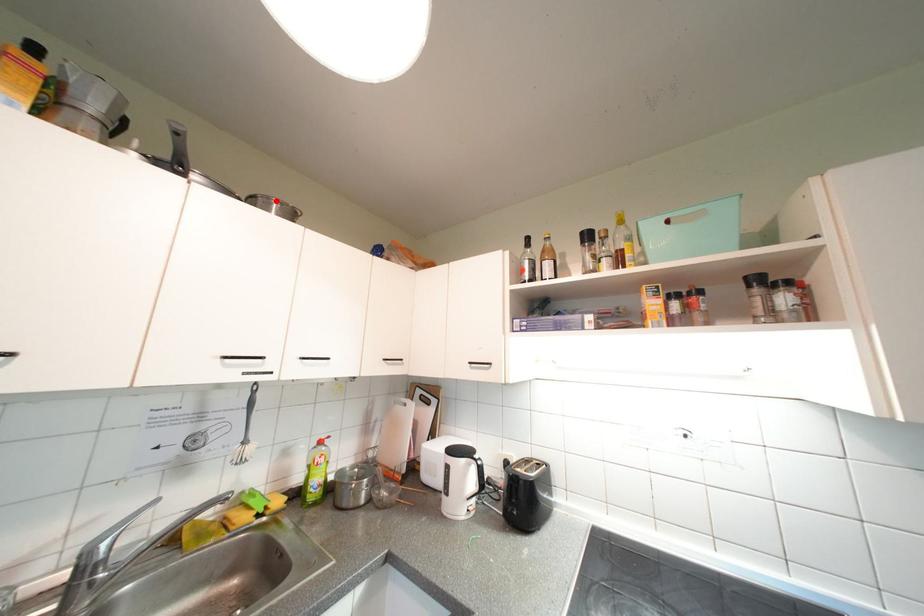
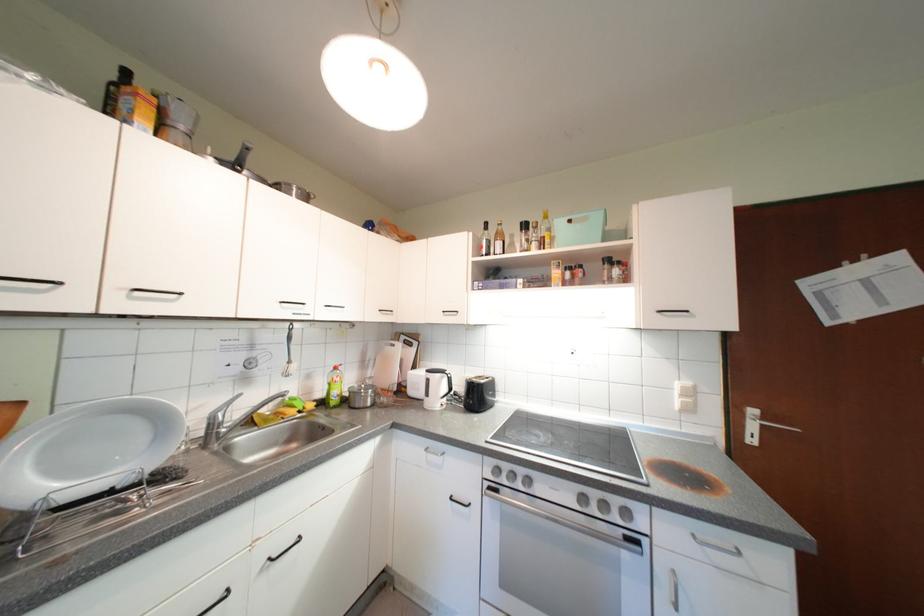
Where in the second image is the point corresponding to the highlighted location from the first image?

(298, 187)